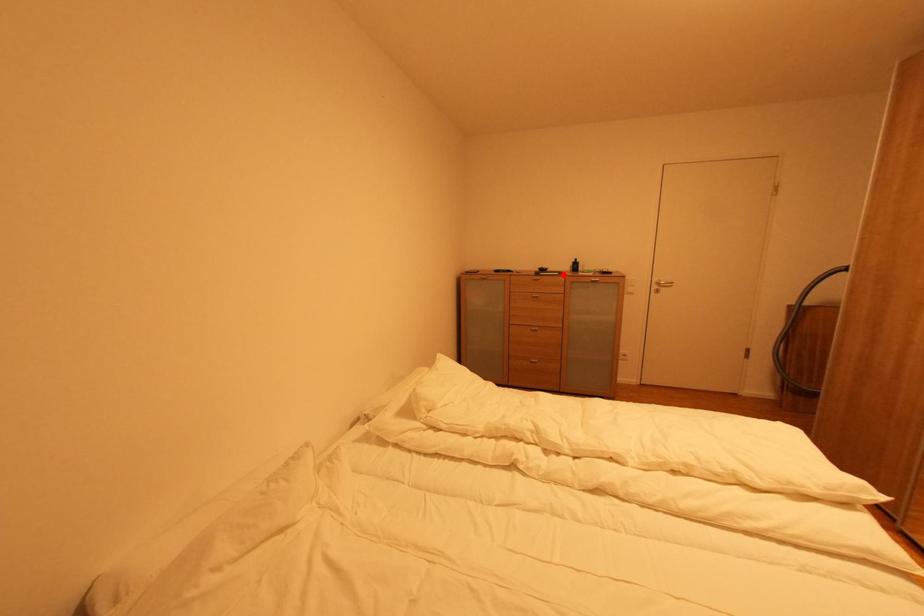
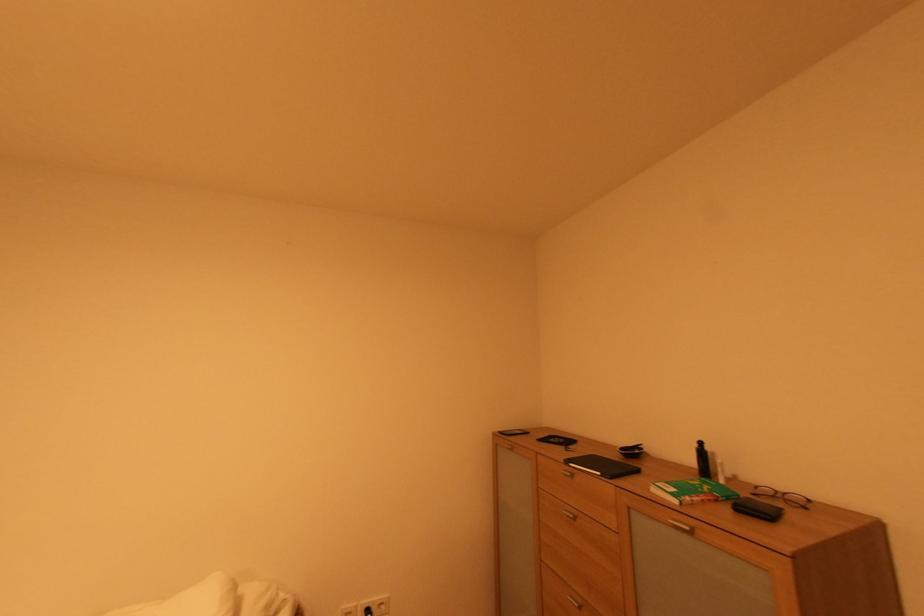
In the second image, find the point that corresponds to the highlighted location in the first image.

(604, 475)